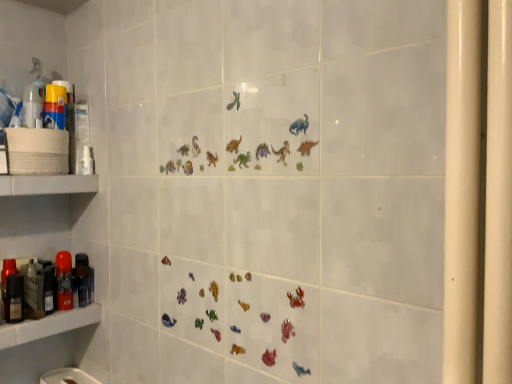
Measure the distance between point [10,305] and camera.

Point [10,305] and camera are 3.92 feet apart from each other.

This screenshot has height=384, width=512. I want to click on metallic black hairdryer at left, the third toiletry from the front, so click(x=84, y=280).

What do you see at coordinates (47, 184) in the screenshot?
I see `white matte shelf at left, the 1th shelf when ordered from top to bottom` at bounding box center [47, 184].

This screenshot has height=384, width=512. Find the location of `matte red spray can at left, the 2th toiletry from the left`. matte red spray can at left, the 2th toiletry from the left is located at coordinates (64, 280).

Starting from the metallic black hairdryer at left, the third toiletry from the front, which shelf is the 2nd one to the left? Please provide its 2D coordinates.

[(47, 184)]

Does metallic black hairdryer at left, the third toiletry from the front, appear on the left side of white matte shelf at left, the 2th shelf ordered from the bottom?

No.

Is point (84, 302) more distant than point (53, 177)?

Yes, it is behind point (53, 177).

From a real-world perspective, is metallic black hairdryer at left, which is the third toiletry from left to right, beneath white matte shelf at left, the 1th shelf when ordered from top to bottom?

Yes, from a real-world perspective, metallic black hairdryer at left, which is the third toiletry from left to right, is beneath white matte shelf at left, the 1th shelf when ordered from top to bottom.

Is white matte shelf at left, the 1th shelf when ordered from top to bottom, aimed at metallic black hairdryer at left, positioned as the first toiletry in right-to-left order?

No, white matte shelf at left, the 1th shelf when ordered from top to bottom, is not oriented towards metallic black hairdryer at left, positioned as the first toiletry in right-to-left order.

Would you say white matte shelf at left, the 1th shelf when ordered from top to bottom, contains metallic black hairdryer at left, which is the third toiletry from left to right?

No, metallic black hairdryer at left, which is the third toiletry from left to right, is not a part of white matte shelf at left, the 1th shelf when ordered from top to bottom.

From a real-world perspective, which object rests below the other?

metallic black hairdryer at left, positioned as the first toiletry in back-to-front order.

Between white matte shelf at left, the 1th shelf when ordered from top to bottom, and metallic black hairdryer at left, which is the third toiletry from left to right, which one appears on the right side from the viewer's perspective?

Positioned to the right is metallic black hairdryer at left, which is the third toiletry from left to right.

Who is smaller, translucent plastic spray bottle at left or white matte shelf at left, the 2th shelf ordered from the bottom?

With smaller size is translucent plastic spray bottle at left.

Which is nearer, (24, 91) or (6, 179)?

Positioned in front is point (6, 179).

Considering the sizes of objects translucent plastic spray bottle at left and white matte shelf at left, the 1th shelf when ordered from top to bottom, in the image provided, who is wider, translucent plastic spray bottle at left or white matte shelf at left, the 1th shelf when ordered from top to bottom,?

white matte shelf at left, the 1th shelf when ordered from top to bottom, is wider.

Which object is more forward, translucent plastic spray bottle at left or white matte shelf at left, the 2th shelf ordered from the bottom?

white matte shelf at left, the 2th shelf ordered from the bottom, is in front.

In terms of width, does matte black soap dispenser at left, which appears as the 1th toiletry when viewed from the front, look wider or thinner when compared to metallic black hairdryer at left, positioned as the first toiletry in back-to-front order?

In the image, matte black soap dispenser at left, which appears as the 1th toiletry when viewed from the front, appears to be more narrow than metallic black hairdryer at left, positioned as the first toiletry in back-to-front order.

Would you say matte black soap dispenser at left, the 3th toiletry in the right-to-left sequence, is inside or outside metallic black hairdryer at left, positioned as the first toiletry in back-to-front order?

matte black soap dispenser at left, the 3th toiletry in the right-to-left sequence, is spatially situated outside metallic black hairdryer at left, positioned as the first toiletry in back-to-front order.

Considering the relative sizes of matte black soap dispenser at left, which appears as the 1th toiletry when viewed from the front, and metallic black hairdryer at left, which is the third toiletry from left to right, in the image provided, is matte black soap dispenser at left, which appears as the 1th toiletry when viewed from the front, bigger than metallic black hairdryer at left, which is the third toiletry from left to right,?

Actually, matte black soap dispenser at left, which appears as the 1th toiletry when viewed from the front, might be smaller than metallic black hairdryer at left, which is the third toiletry from left to right.

From a real-world perspective, is matte black soap dispenser at left, the 3th toiletry in the right-to-left sequence, below metallic black hairdryer at left, positioned as the first toiletry in back-to-front order?

Yes, from a real-world perspective, matte black soap dispenser at left, the 3th toiletry in the right-to-left sequence, is below metallic black hairdryer at left, positioned as the first toiletry in back-to-front order.

Is matte plastic shelf at lower left, the 1th shelf in the bottom-to-top sequence, inside metallic black hairdryer at left, positioned as the first toiletry in right-to-left order?

Actually, matte plastic shelf at lower left, the 1th shelf in the bottom-to-top sequence, is outside metallic black hairdryer at left, positioned as the first toiletry in right-to-left order.

Is metallic black hairdryer at left, which is the third toiletry from left to right, bigger or smaller than matte plastic shelf at lower left, which is the 2th shelf in top-to-bottom order?

Clearly, metallic black hairdryer at left, which is the third toiletry from left to right, is smaller in size than matte plastic shelf at lower left, which is the 2th shelf in top-to-bottom order.

Considering the positions of points (91, 280) and (45, 316), is point (91, 280) farther from camera compared to point (45, 316)?

Yes, it is.

From the picture: Could you tell me if metallic black hairdryer at left, positioned as the first toiletry in right-to-left order, is turned towards matte plastic shelf at lower left, the 1th shelf in the bottom-to-top sequence?

No, metallic black hairdryer at left, positioned as the first toiletry in right-to-left order, does not turn towards matte plastic shelf at lower left, the 1th shelf in the bottom-to-top sequence.

Consider the image. How different are the orientations of white matte shelf at left, the 2th shelf ordered from the bottom, and matte black soap dispenser at left, which appears as the 1th toiletry when viewed from the front, in degrees?

3.06 degrees.

Is white matte shelf at left, the 1th shelf when ordered from top to bottom, placed right next to matte black soap dispenser at left, the 3th toiletry in the right-to-left sequence?

No, white matte shelf at left, the 1th shelf when ordered from top to bottom, is not with matte black soap dispenser at left, the 3th toiletry in the right-to-left sequence.

Is white matte shelf at left, the 2th shelf ordered from the bottom, aimed at matte black soap dispenser at left, the 3th toiletry positioned from the back?

No, white matte shelf at left, the 2th shelf ordered from the bottom, is not facing towards matte black soap dispenser at left, the 3th toiletry positioned from the back.

Consider the image. Visually, is white matte shelf at left, the 2th shelf ordered from the bottom, positioned to the left or to the right of matte black soap dispenser at left, the 3th toiletry positioned from the back?

Clearly, white matte shelf at left, the 2th shelf ordered from the bottom, is on the right of matte black soap dispenser at left, the 3th toiletry positioned from the back, in the image.

Does point (36, 75) lie behind point (22, 301)?

Yes, it is behind point (22, 301).

From a real-world perspective, between translucent plastic spray bottle at left and matte black soap dispenser at left, which appears as the 1th toiletry when viewed from the front, who is vertically higher?

translucent plastic spray bottle at left, from a real-world perspective.

Which is correct: translucent plastic spray bottle at left is inside matte black soap dispenser at left, arranged as the first toiletry when viewed from the left, or outside of it?

translucent plastic spray bottle at left lies outside matte black soap dispenser at left, arranged as the first toiletry when viewed from the left.

Is translucent plastic spray bottle at left far away from matte black soap dispenser at left, the 3th toiletry in the right-to-left sequence?

No.

The image size is (512, 384). I want to click on the 2nd toiletry below the white matte shelf at left, the 1th shelf when ordered from top to bottom (from the image's perspective), so click(84, 280).

At what (x,y) coordinates should I click in order to perform the action: click on toiletry that is the 3rd one when counting backward from the white matte shelf at left, the 2th shelf ordered from the bottom. Please return your answer as a coordinate pair (x, y). Looking at the image, I should click on (84, 280).

From the image, which object appears to be farther from matte plastic shelf at lower left, which is the 2th shelf in top-to-bottom order, white matte shelf at left, the 2th shelf ordered from the bottom, or matte red spray can at left, the second toiletry positioned from the back?

white matte shelf at left, the 2th shelf ordered from the bottom, is further to matte plastic shelf at lower left, which is the 2th shelf in top-to-bottom order.

Estimate the real-world distances between objects in this image. Which object is closer to white matte shelf at left, the 2th shelf ordered from the bottom, matte black soap dispenser at left, which appears as the 1th toiletry when viewed from the front, or metallic black hairdryer at left, which is the third toiletry from left to right?

metallic black hairdryer at left, which is the third toiletry from left to right, is closer to white matte shelf at left, the 2th shelf ordered from the bottom.

Estimate the real-world distances between objects in this image. Which object is further from matte black soap dispenser at left, the 3th toiletry in the right-to-left sequence, translucent plastic spray bottle at left or metallic black hairdryer at left, positioned as the first toiletry in right-to-left order?

Based on the image, translucent plastic spray bottle at left appears to be further to matte black soap dispenser at left, the 3th toiletry in the right-to-left sequence.

In the scene shown: Estimate the real-world distances between objects in this image. Which object is further from matte plastic shelf at lower left, which is the 2th shelf in top-to-bottom order, translucent plastic spray bottle at left or matte red spray can at left, the second toiletry positioned from the back?

Based on the image, translucent plastic spray bottle at left appears to be further to matte plastic shelf at lower left, which is the 2th shelf in top-to-bottom order.

Considering their positions, is translucent plastic spray bottle at left positioned further to matte red spray can at left, arranged as the 2th toiletry when viewed from the right, than metallic black hairdryer at left, the third toiletry from the front?

The object further to matte red spray can at left, arranged as the 2th toiletry when viewed from the right, is translucent plastic spray bottle at left.

Considering their positions, is matte red spray can at left, the 2th toiletry from the left, positioned closer to metallic black hairdryer at left, positioned as the first toiletry in right-to-left order, than white matte shelf at left, the 2th shelf ordered from the bottom?

matte red spray can at left, the 2th toiletry from the left, is closer to metallic black hairdryer at left, positioned as the first toiletry in right-to-left order.

In the scene shown: Based on their spatial positions, is matte plastic shelf at lower left, the 1th shelf in the bottom-to-top sequence, or translucent plastic spray bottle at left further from matte red spray can at left, which appears as the 2th toiletry when viewed from the front?

translucent plastic spray bottle at left.

Which object lies further to the anchor point metallic black hairdryer at left, positioned as the first toiletry in back-to-front order, translucent plastic spray bottle at left or white matte shelf at left, the 1th shelf when ordered from top to bottom?

translucent plastic spray bottle at left.

This screenshot has height=384, width=512. What are the coordinates of `toiletry located between matte plastic shelf at lower left, the 1th shelf in the bottom-to-top sequence, and matte red spray can at left, the second toiletry positioned from the back, in the depth direction` in the screenshot? It's located at (14, 298).

Find the location of `shelf between translucent plastic spray bottle at left and matte red spray can at left, arranged as the 2th toiletry when viewed from the right, from top to bottom`. shelf between translucent plastic spray bottle at left and matte red spray can at left, arranged as the 2th toiletry when viewed from the right, from top to bottom is located at coordinates (47, 184).

You are a GUI agent. You are given a task and a screenshot of the screen. Output one action in this format:
    pyautogui.click(x=<x>, y=<y>)
    Task: Click on the shelf between translucent plastic spray bottle at left and matte plastic shelf at lower left, the 1th shelf in the bottom-to-top sequence, in the vertical direction
    This screenshot has width=512, height=384.
    Given the screenshot: What is the action you would take?
    pyautogui.click(x=47, y=184)

I want to click on shelf between translucent plastic spray bottle at left and matte black soap dispenser at left, the 3th toiletry positioned from the back, in the up-down direction, so click(47, 184).